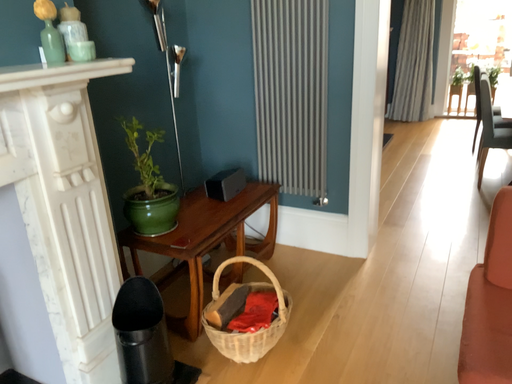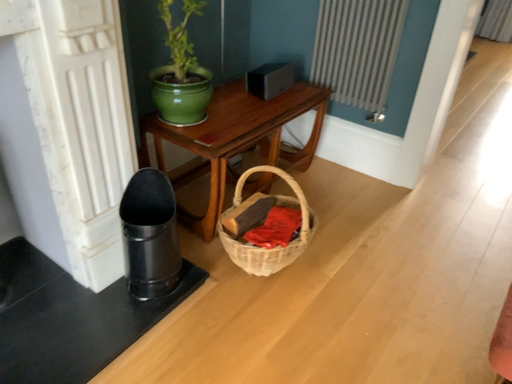
Question: How did the camera likely rotate when shooting the video?

Choices:
 (A) rotated left
 (B) rotated right

Answer: (A)